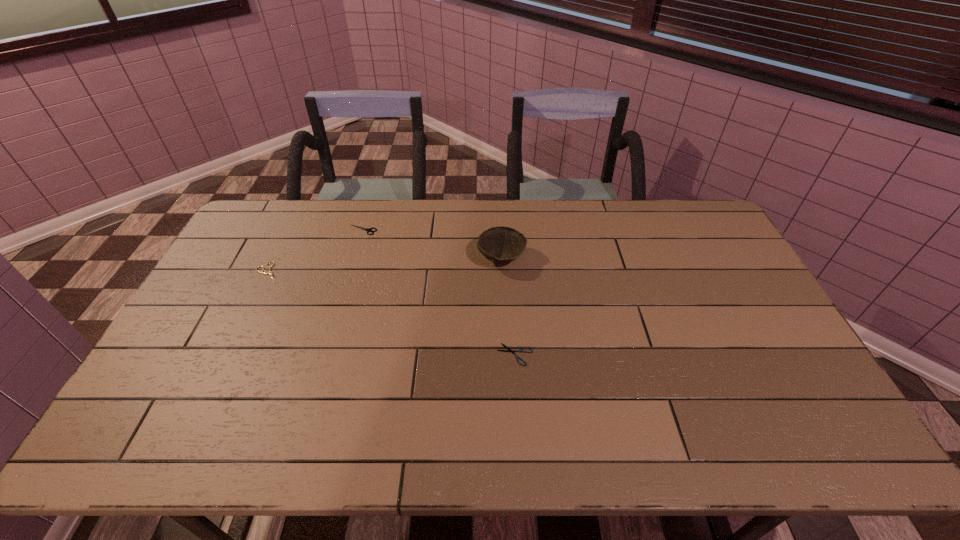
Locate an element on the screen. vacant region located 0.360m on the left of the shortest shears is located at coordinates (366, 354).

You are a GUI agent. You are given a task and a screenshot of the screen. Output one action in this format:
    pyautogui.click(x=<x>, y=<y>)
    Task: Click on the object that is at the far edge
    The height and width of the screenshot is (540, 960).
    Given the screenshot: What is the action you would take?
    pyautogui.click(x=366, y=229)

In order to click on object present at the left edge in this screenshot , I will do `click(270, 272)`.

Where is `free space at the far edge of the desktop`? The width and height of the screenshot is (960, 540). free space at the far edge of the desktop is located at coordinates (449, 204).

At what (x,y) coordinates should I click in order to perform the action: click on vacant space at the near edge. Please return your answer as a coordinate pair (x, y). Looking at the image, I should click on (722, 428).

Locate an element on the screen. blank area at the left edge is located at coordinates (191, 353).

At what (x,y) coordinates should I click in order to perform the action: click on vacant region at the right edge of the desktop. Please return your answer as a coordinate pair (x, y). The height and width of the screenshot is (540, 960). Looking at the image, I should click on (737, 275).

Where is `free space at the far left corner of the desktop`? free space at the far left corner of the desktop is located at coordinates (245, 238).

This screenshot has width=960, height=540. In the image, there is a desktop. Find the location of `vacant space at the near right corner`. vacant space at the near right corner is located at coordinates (817, 433).

Identify the location of empty location between the bowl and the nearest shears. This screenshot has height=540, width=960. (508, 306).